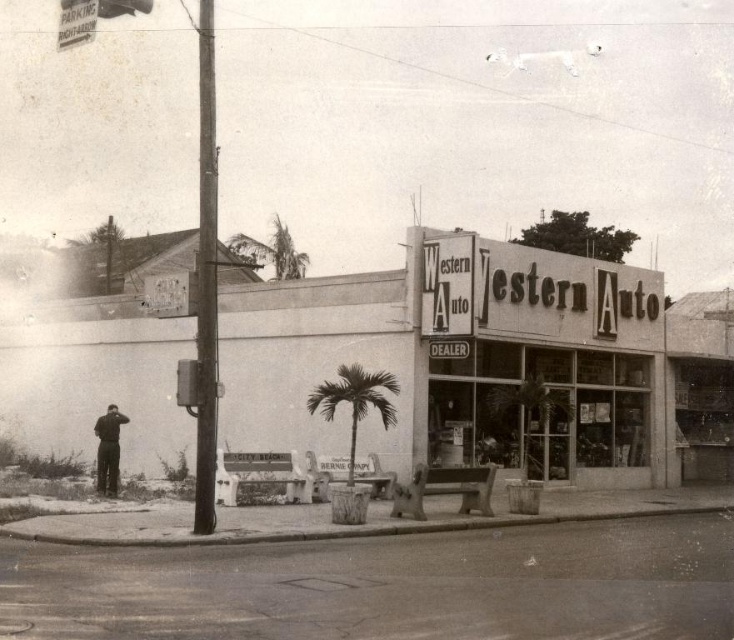
You are standing at the point labeled point (393, 406) and want to walk to the point labeled point (250, 236). According to the scene, will you be moving towards the Western Auto building or away from it?

Since point (393, 406) is in front of point (250, 236), moving from point (393, 406) to point (250, 236) means you are moving away from the Western Auto building.

You are standing at the corner of the street and want to find the white concrete western auto at center. According to the coordinates provided, in which direction should you walk to reach it?

The white concrete western auto at center is located at coordinates point (534, 352). Since these coordinates are relative to the image, you should walk towards the center of the image to reach it.

You are a pedestrian standing on the sidewalk in front of the Western Auto store. You notice the green leafy palm tree at center and the white concrete Western Auto at center. Which object is closer to you, the pedestrian?

The white concrete Western Auto at center is closer to you because the green leafy palm tree at center is positioned behind it.